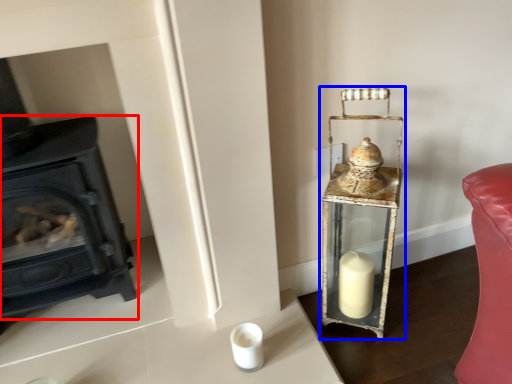
Question: Which of the following is the closest to the observer, wood burning stove (highlighted by a red box) or table lamp (highlighted by a blue box)?

Choices:
 (A) wood burning stove
 (B) table lamp

Answer: (A)